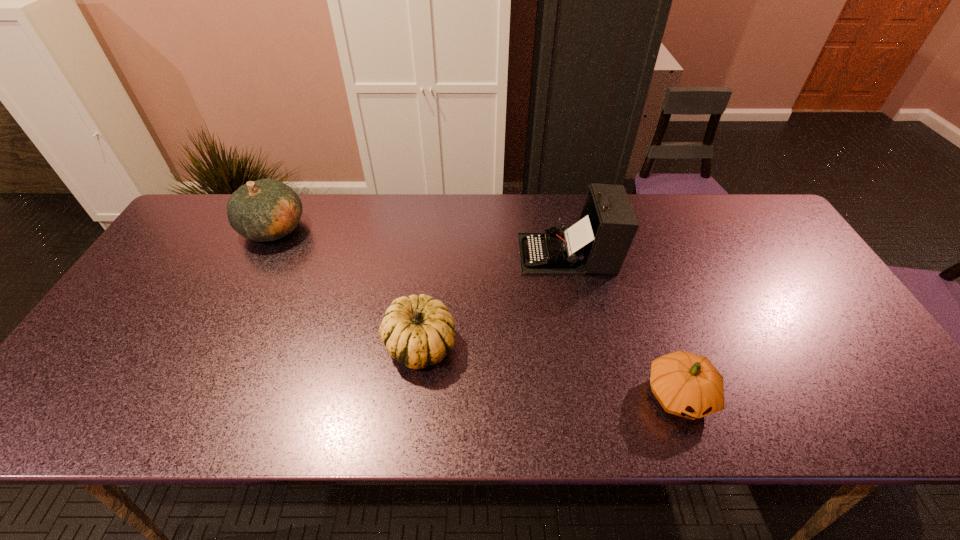
The height and width of the screenshot is (540, 960). Identify the location of typewriter at the far edge. (598, 243).

You are a GUI agent. You are given a task and a screenshot of the screen. Output one action in this format:
    pyautogui.click(x=<x>, y=<y>)
    Task: Click on the gourd positioned at the far edge
    This screenshot has height=540, width=960.
    Given the screenshot: What is the action you would take?
    pyautogui.click(x=263, y=210)

At what (x,y) coordinates should I click in order to perform the action: click on object positioned at the near edge. Please return your answer as a coordinate pair (x, y). The image size is (960, 540). Looking at the image, I should click on (688, 385).

The image size is (960, 540). What are the coordinates of `vacant area at the far edge of the desktop` in the screenshot? It's located at (351, 241).

Find the location of `vacant space at the near edge of the desktop`. vacant space at the near edge of the desktop is located at coordinates (432, 396).

Where is `free spot at the left edge of the desktop`? Image resolution: width=960 pixels, height=540 pixels. free spot at the left edge of the desktop is located at coordinates (167, 253).

In the image, there is a desktop. Identify the location of free space at the right edge. The height and width of the screenshot is (540, 960). (777, 286).

The height and width of the screenshot is (540, 960). Find the location of `free region at the far left corner of the desktop`. free region at the far left corner of the desktop is located at coordinates (220, 236).

Find the location of a particular element. This screenshot has width=960, height=540. free spot at the near left corner of the desktop is located at coordinates (118, 405).

In the image, there is a desktop. Where is `free space at the far right corner`? free space at the far right corner is located at coordinates (720, 208).